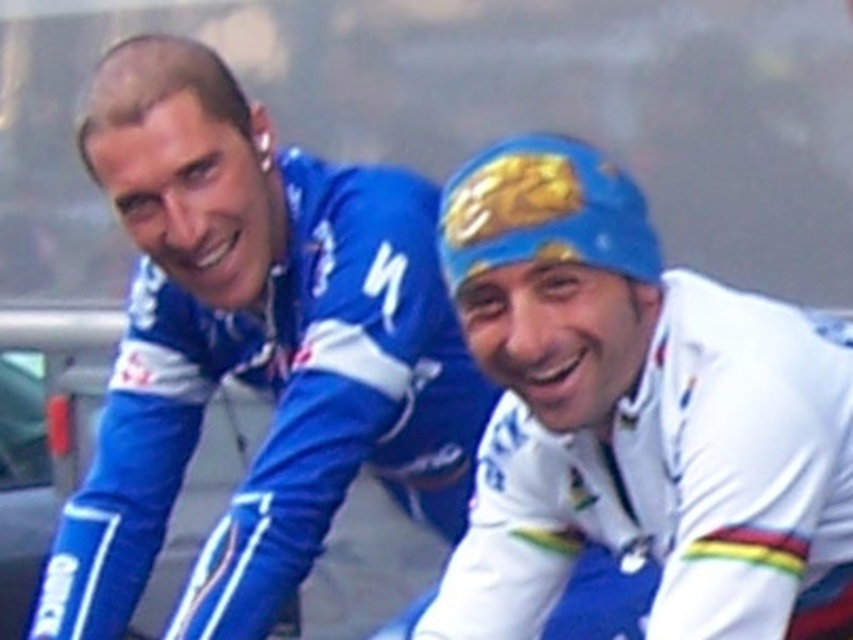
You are a photographer setting up for a cycling event. You need to ensure that the matte blue jersey at upper left and the white glossy jersey at center are visible in your shot. Based on their positions and possible widths, which jersey might require more space in the frame?

The matte blue jersey at upper left might be wider than the white glossy jersey at center, so it might require more space in the frame to ensure it is fully visible.

You are a photographer setting up for a cycling event. You need to ensure that the matte blue jersey at upper left and the white glossy jersey at center are visible in your photo. Given their sizes, which jersey should you focus on to capture more of the details?

The matte blue jersey at upper left has a greater height compared to the white glossy jersey at center, so focusing on it will allow you to capture more details due to its larger size.

You are a photographer positioned in front of the cyclists. You need to capture a photo where both the matte blue jersey at upper left and the white glossy jersey at center are clearly visible. Based on their positions, which jersey should you focus on first to ensure both are in frame?

The matte blue jersey at upper left is to the left of the white glossy jersey at center, so you should focus on the white glossy jersey at center first to ensure both are in frame.